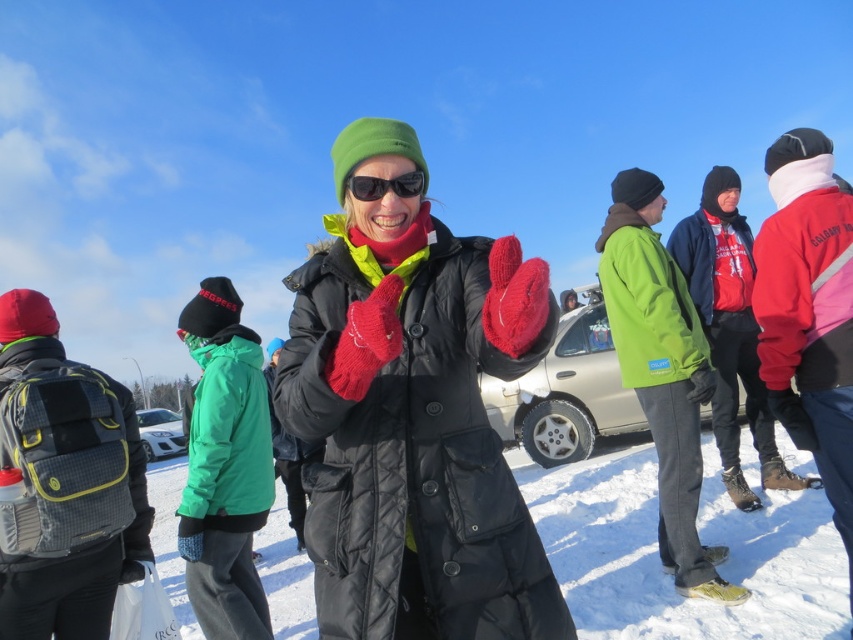
Who is positioned more to the left, red fleece jacket at right or metallic silver car at center?

From the viewer's perspective, red fleece jacket at right appears more on the left side.

Which is above, red fleece jacket at right or metallic silver car at center?

red fleece jacket at right

Find the location of a particular element. This screenshot has height=640, width=853. red fleece jacket at right is located at coordinates (809, 310).

Where is `red fleece jacket at right`? Image resolution: width=853 pixels, height=640 pixels. red fleece jacket at right is located at coordinates (809, 310).

Describe the element at coordinates (64, 483) in the screenshot. I see `gray mesh backpack at left` at that location.

Is gray mesh backpack at left shorter than black plastic sunglasses at center?

In fact, gray mesh backpack at left may be taller than black plastic sunglasses at center.

Which is behind, point (54, 456) or point (370, 186)?

Positioned behind is point (54, 456).

Where is `gray mesh backpack at left`? The width and height of the screenshot is (853, 640). gray mesh backpack at left is located at coordinates (64, 483).

In the scene shown: Is red fleece jacket at right positioned in front of white matte car at center?

Yes, red fleece jacket at right is closer to the viewer.

Who is shorter, red fleece jacket at right or white matte car at center?

red fleece jacket at right is shorter.

Is point (798, 296) farther from camera compared to point (155, 442)?

No, (798, 296) is in front of (155, 442).

Identify the location of red fleece jacket at right. (809, 310).